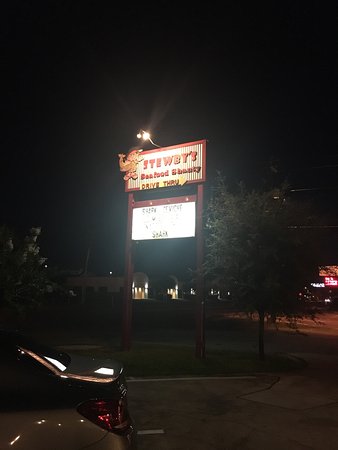
Where is `light hanging over sign`? light hanging over sign is located at coordinates (145, 135).